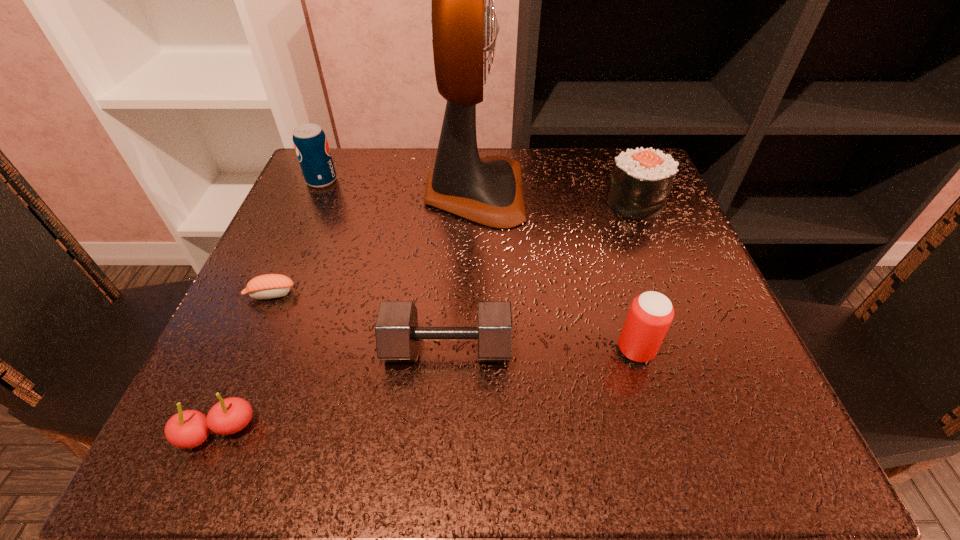
Find the location of a particular element. The image size is (960, 540). free region located 0.330m on the front of the pop is located at coordinates (266, 308).

Image resolution: width=960 pixels, height=540 pixels. What are the coordinates of `vacant position located 0.090m on the back of the farther sushi` in the screenshot? It's located at (619, 165).

This screenshot has width=960, height=540. Identify the location of free space located on the left of the beer can. (530, 350).

You are a GUI agent. You are given a task and a screenshot of the screen. Output one action in this format:
    pyautogui.click(x=<x>, y=<y>)
    Task: Click on the vacant region located 0.130m on the right of the dumbbell
    This screenshot has height=540, width=960.
    Given the screenshot: What is the action you would take?
    pyautogui.click(x=596, y=349)

Where is `free space located 0.110m on the back of the nearest object`? This screenshot has width=960, height=540. free space located 0.110m on the back of the nearest object is located at coordinates tap(256, 341).

Image resolution: width=960 pixels, height=540 pixels. I want to click on vacant point located 0.270m on the right of the shortest object, so click(458, 294).

Locate an element on the screen. This screenshot has width=960, height=540. fan that is at the far edge is located at coordinates (488, 191).

The width and height of the screenshot is (960, 540). I want to click on pop located in the far edge section of the desktop, so click(310, 142).

Locate an element on the screen. Image resolution: width=960 pixels, height=540 pixels. sushi located at the far edge is located at coordinates (641, 179).

Where is `object that is positioned at the near edge`? object that is positioned at the near edge is located at coordinates (187, 429).